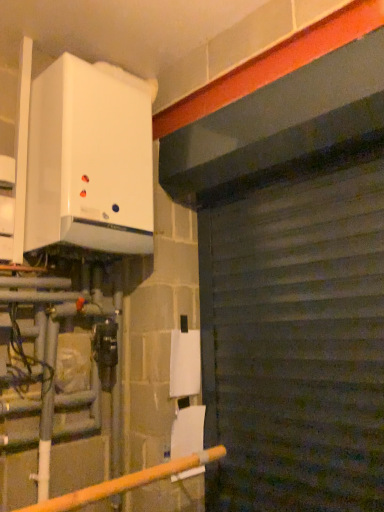
Question: Should I look upward or downward to see yellow matte pipe at lower left?

Choices:
 (A) up
 (B) down

Answer: (B)

Question: Does white glossy boiler at upper left have a larger size compared to yellow matte pipe at lower left?

Choices:
 (A) yes
 (B) no

Answer: (A)

Question: From a real-world perspective, does white glossy boiler at upper left sit lower than yellow matte pipe at lower left?

Choices:
 (A) yes
 (B) no

Answer: (B)

Question: Is white glossy boiler at upper left thinner than yellow matte pipe at lower left?

Choices:
 (A) yes
 (B) no

Answer: (B)

Question: Could you tell me if white glossy boiler at upper left is turned towards yellow matte pipe at lower left?

Choices:
 (A) yes
 (B) no

Answer: (B)

Question: Is white glossy boiler at upper left taller than yellow matte pipe at lower left?

Choices:
 (A) yes
 (B) no

Answer: (A)

Question: Considering the relative sizes of white glossy boiler at upper left and yellow matte pipe at lower left in the image provided, is white glossy boiler at upper left smaller than yellow matte pipe at lower left?

Choices:
 (A) yes
 (B) no

Answer: (B)

Question: Considering the relative sizes of white glossy boiler at upper left and dark gray corrugated metal at center in the image provided, is white glossy boiler at upper left shorter than dark gray corrugated metal at center?

Choices:
 (A) no
 (B) yes

Answer: (B)

Question: Can you confirm if white glossy boiler at upper left is taller than dark gray corrugated metal at center?

Choices:
 (A) no
 (B) yes

Answer: (A)

Question: Is dark gray corrugated metal at center surrounded by white glossy boiler at upper left?

Choices:
 (A) no
 (B) yes

Answer: (A)

Question: Would you consider white glossy boiler at upper left to be distant from dark gray corrugated metal at center?

Choices:
 (A) no
 (B) yes

Answer: (A)

Question: Is white glossy boiler at upper left to the right of dark gray corrugated metal at center from the viewer's perspective?

Choices:
 (A) no
 (B) yes

Answer: (A)

Question: From the image's perspective, is white glossy boiler at upper left over dark gray corrugated metal at center?

Choices:
 (A) yes
 (B) no

Answer: (A)

Question: Does dark gray corrugated metal at center have a lesser width compared to white glossy boiler at upper left?

Choices:
 (A) no
 (B) yes

Answer: (B)